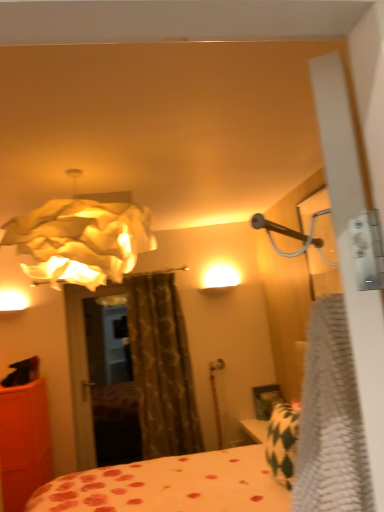
Question: Is point (4, 397) closer or farther from the camera than point (104, 229)?

Choices:
 (A) closer
 (B) farther

Answer: (B)

Question: Would you say orange matte cabinet at left is to the left or to the right of white paper lampshade at upper left in the picture?

Choices:
 (A) right
 (B) left

Answer: (B)

Question: Which of these objects is positioned farthest from the polka dot fabric bed at center?

Choices:
 (A) brown textured curtain at center
 (B) white textured blanket at right
 (C) white paper lampshade at upper left
 (D) orange matte cabinet at left

Answer: (B)

Question: Estimate the real-world distances between objects in this image. Which object is closer to the white textured blanket at right?

Choices:
 (A) polka dot fabric bed at center
 (B) orange matte cabinet at left
 (C) white paper lampshade at upper left
 (D) brown textured curtain at center

Answer: (C)